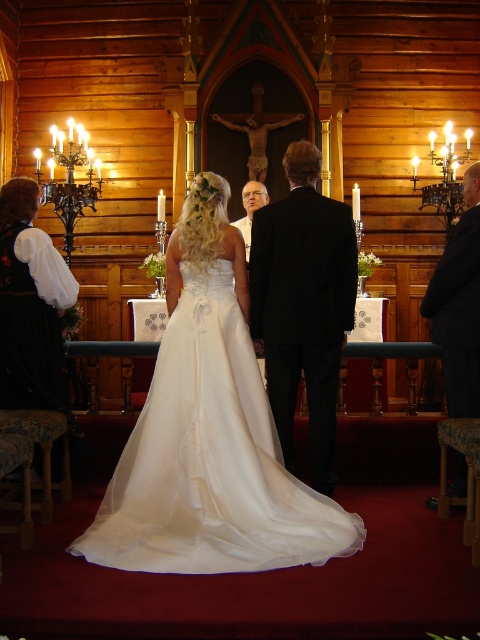
Is satin white dress at center to the right of black satin suit at center from the viewer's perspective?

In fact, satin white dress at center is to the left of black satin suit at center.

From the picture: Which is more to the right, satin white dress at center or black satin suit at center?

black satin suit at center

The height and width of the screenshot is (640, 480). In order to click on satin white dress at center in this screenshot , I will do `click(210, 433)`.

Which is above, black suit at right or white satin dress at left?

black suit at right is above.

Does black suit at right appear on the left side of white satin dress at left?

Incorrect, black suit at right is not on the left side of white satin dress at left.

Where is `black suit at right`? This screenshot has height=640, width=480. black suit at right is located at coordinates (458, 305).

Is black satin suit at center bigger than black suit at right?

Yes.

Is point (294, 305) in front of point (425, 304)?

Yes, point (294, 305) is closer to viewer.

Identify the location of black satin suit at center. The width and height of the screenshot is (480, 640). pyautogui.click(x=303, y=304).